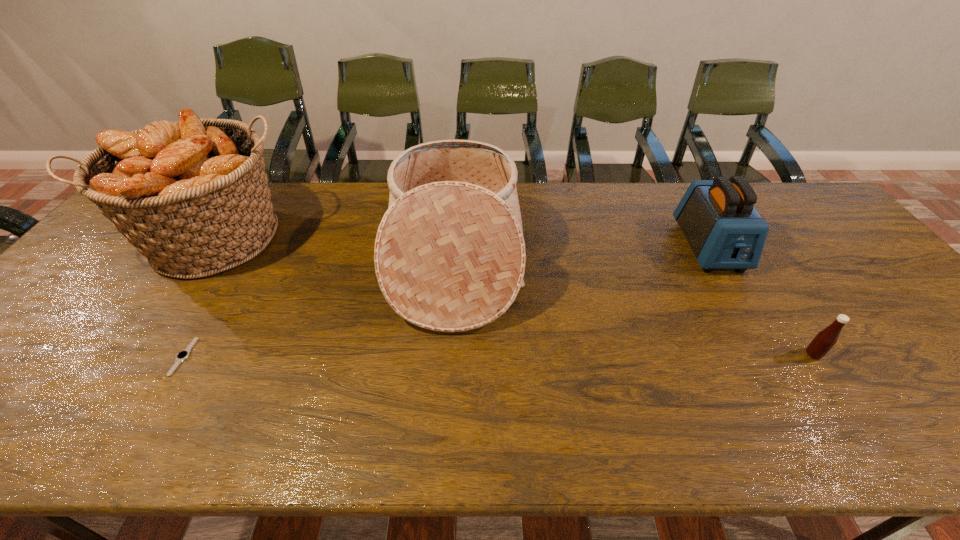
Where is `blank space at the far right corner of the desktop`? The width and height of the screenshot is (960, 540). blank space at the far right corner of the desktop is located at coordinates (787, 220).

At what (x,y) coordinates should I click in order to perform the action: click on free space between the third tallest object and the right basket. Please return your answer as a coordinate pair (x, y). The height and width of the screenshot is (540, 960). Looking at the image, I should click on (582, 254).

Locate an element on the screen. This screenshot has height=540, width=960. vacant space that is in between the left basket and the shorter basket is located at coordinates (338, 250).

Locate an element on the screen. This screenshot has width=960, height=540. free space between the watch and the fourth shortest object is located at coordinates (319, 309).

The height and width of the screenshot is (540, 960). In order to click on free space between the fourth tallest object and the shortest object in this screenshot , I will do `click(498, 355)`.

Image resolution: width=960 pixels, height=540 pixels. In order to click on free spot between the rightmost object and the shortest object in this screenshot , I will do `click(498, 355)`.

The image size is (960, 540). Find the location of `vacant area that lies between the second shortest object and the third shortest object`. vacant area that lies between the second shortest object and the third shortest object is located at coordinates (761, 300).

This screenshot has height=540, width=960. I want to click on vacant area between the left basket and the rightmost object, so click(x=516, y=296).

The width and height of the screenshot is (960, 540). Identify the location of vacant area that lies between the second object from right to left and the third object from right to left. (582, 254).

Select which object is the closest to the left basket. Please provide its 2D coordinates. Your answer should be formatted as a tuple, i.e. [(x, y)], where the tuple contains the x and y coordinates of a point satisfying the conditions above.

[(182, 355)]